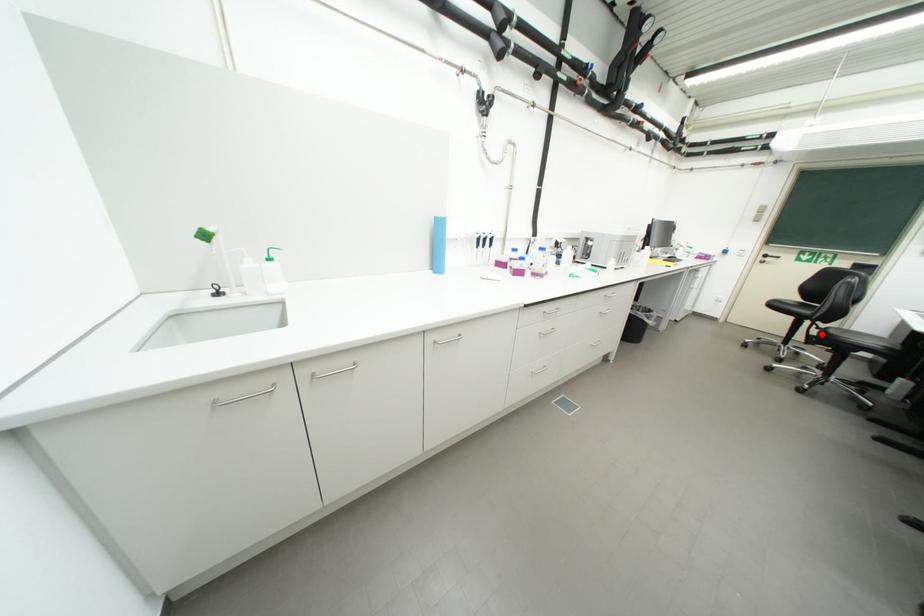
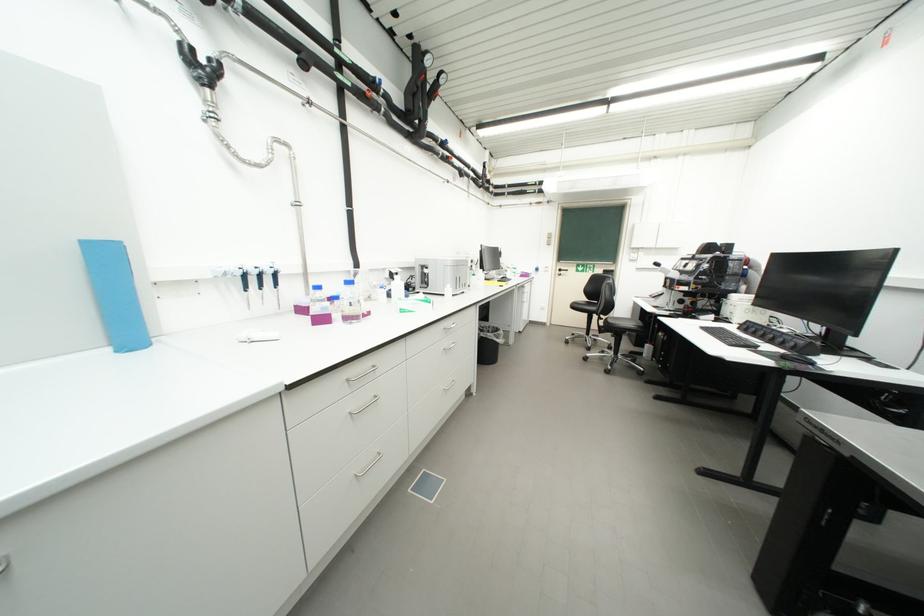
Question: A red point is marked in image1. In image2, is the corresponding 3D point closer to the camera or farther? Reply with the corresponding letter.

Choices:
 (A) The corresponding 3D point is closer.
 (B) The corresponding 3D point is farther.

Answer: (A)